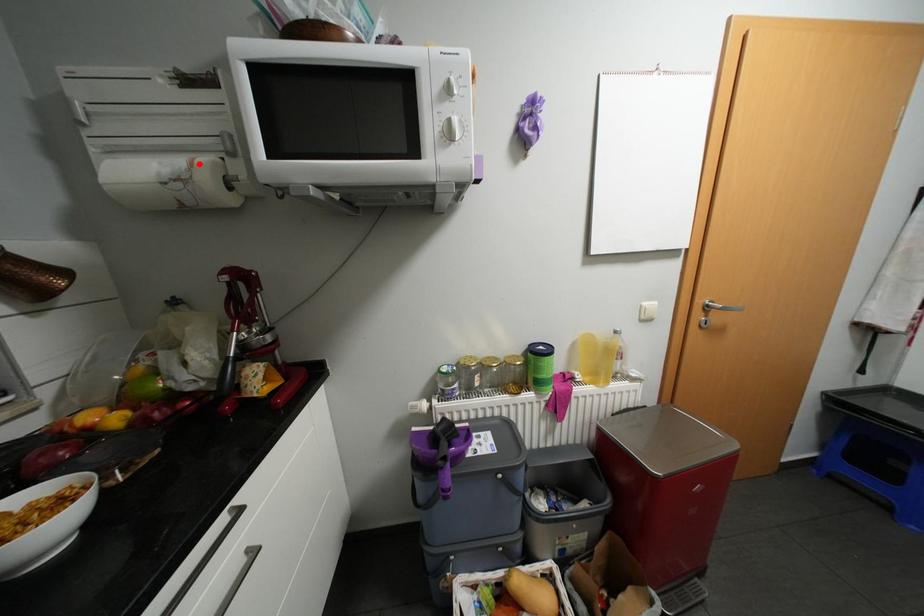
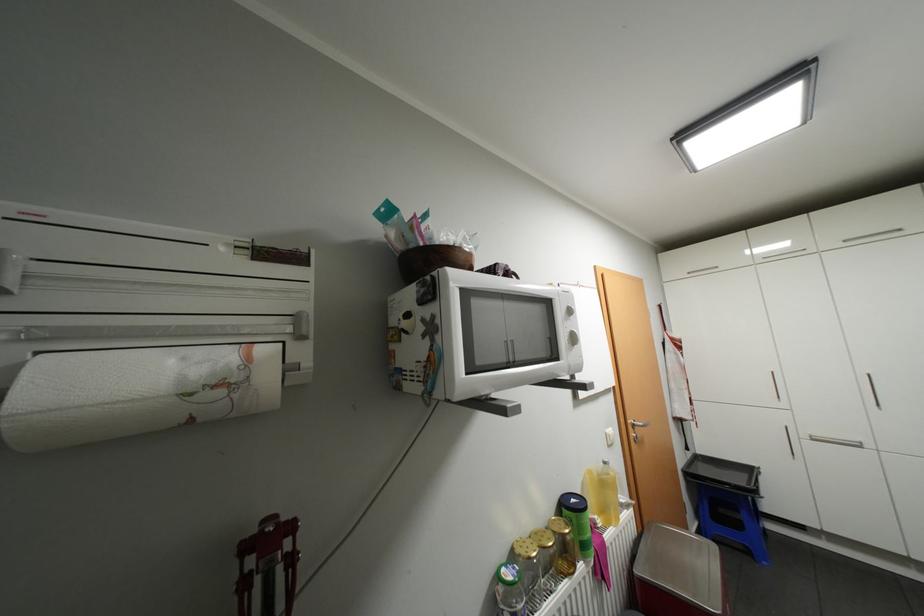
In the second image, find the point that corresponds to the highlighted location in the first image.

(256, 358)